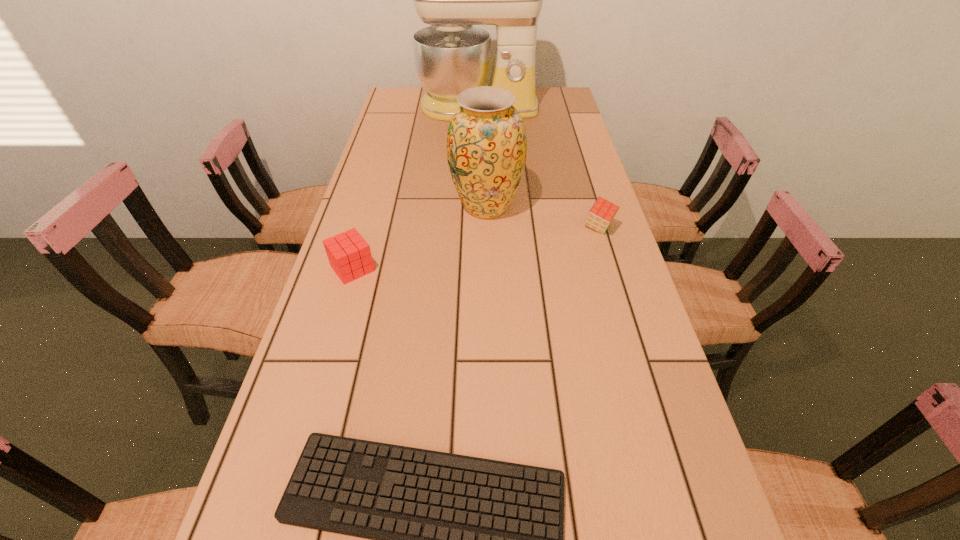
I want to click on mixer, so click(451, 55).

Where is `the tallest object`? The height and width of the screenshot is (540, 960). the tallest object is located at coordinates (451, 55).

Where is `vase`? vase is located at coordinates (486, 142).

Find the location of a particular element. This screenshot has height=540, width=960. the right cube is located at coordinates (601, 214).

Where is `the rightmost object`? The height and width of the screenshot is (540, 960). the rightmost object is located at coordinates (601, 214).

Find the location of a particular element. The image size is (960, 540). the nearer cube is located at coordinates (349, 255).

Locate an element on the screen. This screenshot has width=960, height=540. the second nearest object is located at coordinates (349, 255).

In order to click on free space located 0.100m on the side of the farthest object with the control knob in this screenshot , I will do `click(478, 137)`.

Image resolution: width=960 pixels, height=540 pixels. What are the coordinates of `vacant region located on the back of the vase` in the screenshot? It's located at (485, 134).

Where is `free space located 0.340m on the front of the rightmost object`? The height and width of the screenshot is (540, 960). free space located 0.340m on the front of the rightmost object is located at coordinates (634, 343).